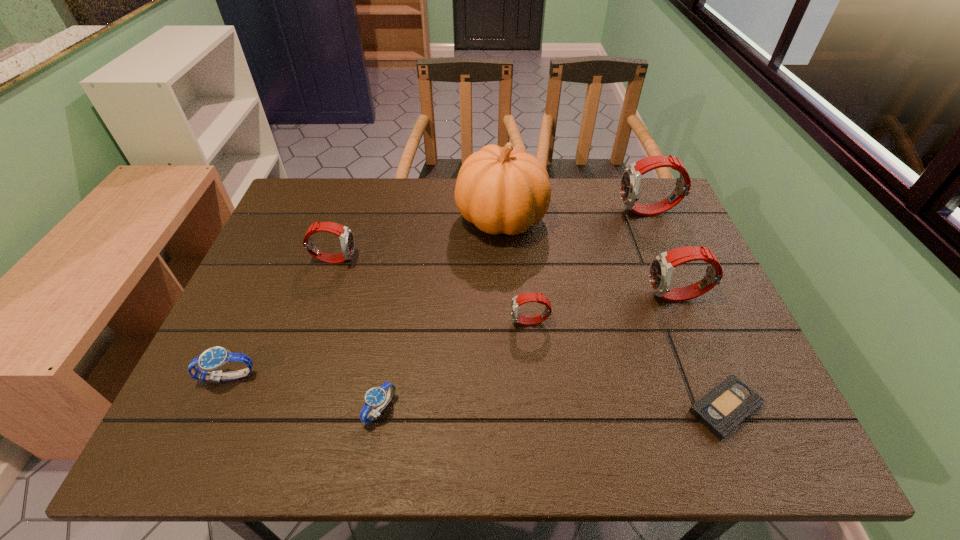
You are a GUI agent. You are given a task and a screenshot of the screen. Output one action in this format:
    pyautogui.click(x=<x>, y=<y>)
    Task: Click on the blank space at the near left corner of the desktop
    This screenshot has height=540, width=960.
    Given the screenshot: What is the action you would take?
    pyautogui.click(x=221, y=422)

Identify the location of vacant space at the far right corner of the desktop. click(x=635, y=214).

I want to click on free space between the leftmost object and the tallest watch, so pyautogui.click(x=439, y=294).

Where is `free spot between the nearer blue watch and the fourth shortest watch`? This screenshot has width=960, height=540. free spot between the nearer blue watch and the fourth shortest watch is located at coordinates (357, 334).

What are the coordinates of `free space between the second object from left to right and the fifth shortest watch` in the screenshot? It's located at (506, 278).

Where is `vacant space that's between the third farthest watch and the third red watch from right to left`? The height and width of the screenshot is (540, 960). vacant space that's between the third farthest watch and the third red watch from right to left is located at coordinates pos(604,309).

The width and height of the screenshot is (960, 540). In order to click on vacant area between the farther blue watch and the second farthest red watch in this screenshot , I will do `click(281, 318)`.

Where is `free space between the third nearest watch and the tallest object`? The height and width of the screenshot is (540, 960). free space between the third nearest watch and the tallest object is located at coordinates (516, 271).

The height and width of the screenshot is (540, 960). Identify the location of empty space that is in between the orange pumpkin and the farthest red watch. (575, 215).

Select which object appears as the fourth closest to the fifth nearest object. Please provide its 2D coordinates. Your answer should be formatted as a tuple, i.e. [(x, y)], where the tuple contains the x and y coordinates of a point satisfying the conditions above.

[(518, 300)]